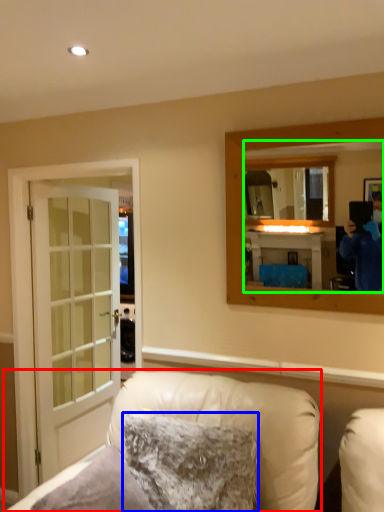
Question: Estimate the real-world distances between objects in this image. Which object is farther from furniture (highlighted by a red box), pillow (highlighted by a blue box) or mirror (highlighted by a green box)?

Choices:
 (A) pillow
 (B) mirror

Answer: (B)